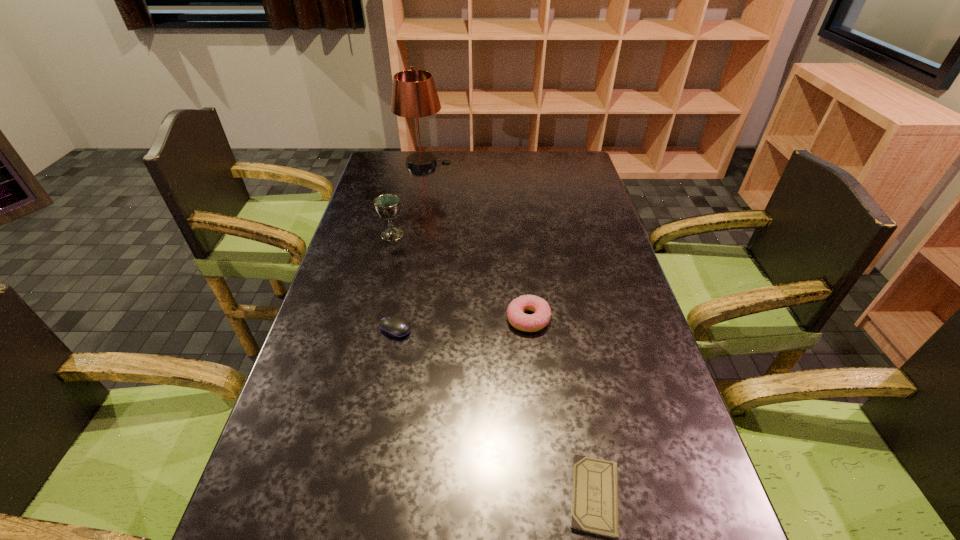
Where is `vacant space situated on the left of the third tallest object`? vacant space situated on the left of the third tallest object is located at coordinates (402, 319).

I want to click on vacant space located on the left of the second shortest object, so click(324, 328).

Locate an element on the screen. vacant space located 0.050m on the left of the shortest object is located at coordinates (539, 496).

Image resolution: width=960 pixels, height=540 pixels. I want to click on object that is positioned at the far edge, so click(x=414, y=95).

You are a GUI agent. You are given a task and a screenshot of the screen. Output one action in this format:
    pyautogui.click(x=<x>, y=<y>)
    Task: Click on the lampshade present at the left edge
    This screenshot has height=540, width=960.
    Given the screenshot: What is the action you would take?
    pyautogui.click(x=414, y=95)

Find the location of a particular element. chalice present at the left edge is located at coordinates (387, 206).

This screenshot has height=540, width=960. What are the coordinates of `object that is at the right edge` in the screenshot? It's located at (594, 505).

In order to click on object that is at the far left corner in this screenshot , I will do [x=414, y=95].

I want to click on vacant space at the far edge of the desktop, so click(533, 169).

I want to click on vacant space at the left edge, so click(335, 397).